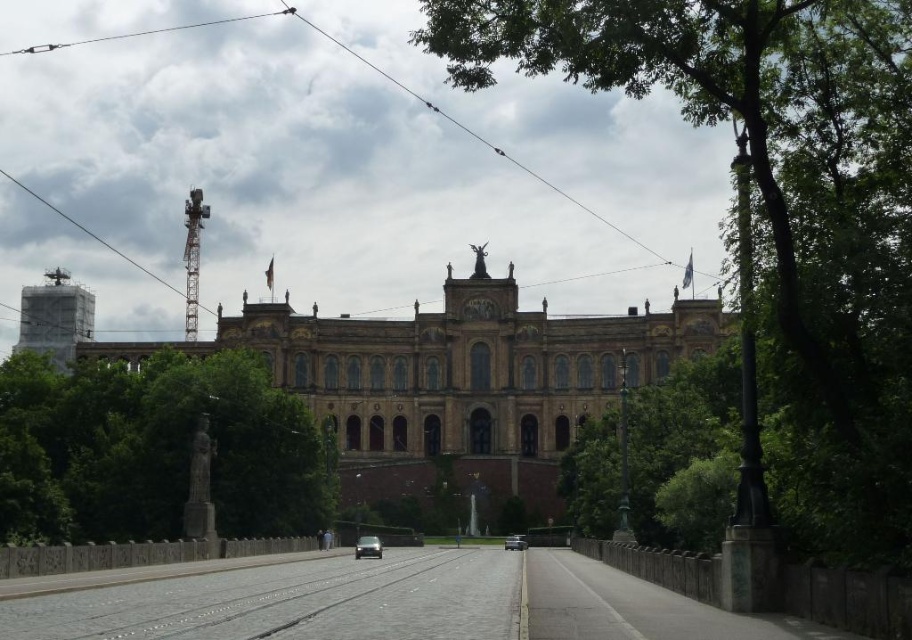
Does green leafy tree at upper right appear over shiny black car at center?

Yes.

Does green leafy tree at upper right have a lesser height compared to shiny black car at center?

No.

Between point (828, 385) and point (514, 544), which one is positioned in front?

Point (828, 385)

Locate an element on the screen. green leafy tree at upper right is located at coordinates (775, 211).

Does brown stone building at center have a lesser width compared to metallic tower at upper left?

Incorrect, brown stone building at center's width is not less than metallic tower at upper left's.

Between brown stone building at center and metallic tower at upper left, which one is positioned lower?

Positioned lower is brown stone building at center.

Is point (461, 337) behind point (34, 193)?

No, it is not.

Image resolution: width=912 pixels, height=640 pixels. In order to click on brown stone building at center in this screenshot , I will do `click(456, 371)`.

Which of these two, brown stone building at center or black wire at upper center, stands taller?

brown stone building at center is taller.

Does brown stone building at center have a lesser width compared to black wire at upper center?

No, brown stone building at center is not thinner than black wire at upper center.

Does point (485, 433) come in front of point (128, 36)?

Yes, it is.

You are a GUI agent. You are given a task and a screenshot of the screen. Output one action in this format:
    pyautogui.click(x=<x>, y=<y>)
    Task: Click on the brown stone building at center
    The height and width of the screenshot is (640, 912).
    Given the screenshot: What is the action you would take?
    pyautogui.click(x=456, y=371)